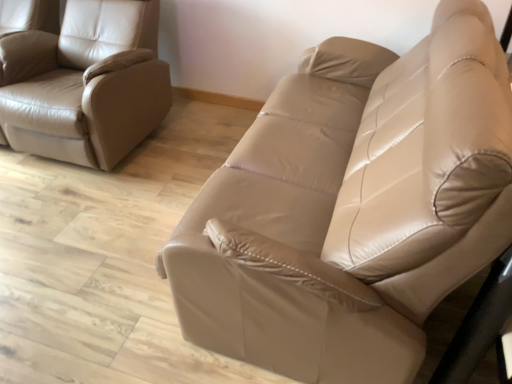
At what (x,y) coordinates should I click in order to perform the action: click on vacant space in front of matte leather chair at left. Please return your answer as a coordinate pair (x, y). The image size is (512, 384). Looking at the image, I should click on (82, 227).